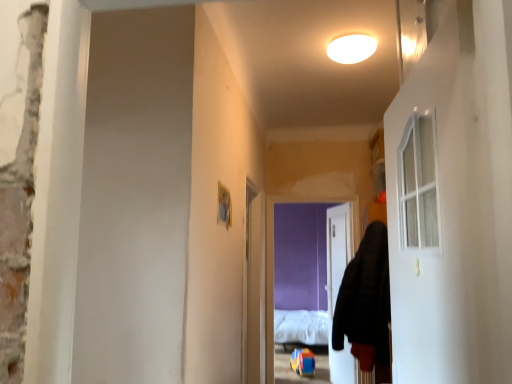
Question: Does black fuzzy hoodie at right come behind white matte ceiling light at upper center?

Choices:
 (A) no
 (B) yes

Answer: (B)

Question: Does black fuzzy hoodie at right have a greater width compared to white matte ceiling light at upper center?

Choices:
 (A) no
 (B) yes

Answer: (B)

Question: Does black fuzzy hoodie at right come in front of white matte ceiling light at upper center?

Choices:
 (A) yes
 (B) no

Answer: (B)

Question: Is black fuzzy hoodie at right looking in the opposite direction of white matte ceiling light at upper center?

Choices:
 (A) no
 (B) yes

Answer: (A)

Question: Does black fuzzy hoodie at right have a greater height compared to white matte ceiling light at upper center?

Choices:
 (A) yes
 (B) no

Answer: (A)

Question: Would you say clear plastic screen door at center is to the left or to the right of white fluffy bed at center in the picture?

Choices:
 (A) right
 (B) left

Answer: (B)

Question: From the image's perspective, relative to white fluffy bed at center, is clear plastic screen door at center above or below?

Choices:
 (A) above
 (B) below

Answer: (A)

Question: Based on their sizes in the image, would you say clear plastic screen door at center is bigger or smaller than white fluffy bed at center?

Choices:
 (A) small
 (B) big

Answer: (A)

Question: From a real-world perspective, is clear plastic screen door at center physically located above or below white fluffy bed at center?

Choices:
 (A) below
 (B) above

Answer: (B)

Question: Considering the relative positions of white fluffy bed at center and white matte ceiling light at upper center in the image provided, is white fluffy bed at center to the left or to the right of white matte ceiling light at upper center?

Choices:
 (A) right
 (B) left

Answer: (A)

Question: Considering the positions of white fluffy bed at center and white matte ceiling light at upper center in the image, is white fluffy bed at center wider or thinner than white matte ceiling light at upper center?

Choices:
 (A) wide
 (B) thin

Answer: (A)

Question: From a real-world perspective, is white fluffy bed at center positioned above or below white matte ceiling light at upper center?

Choices:
 (A) below
 (B) above

Answer: (A)

Question: From the image's perspective, relative to white matte ceiling light at upper center, is white fluffy bed at center above or below?

Choices:
 (A) below
 (B) above

Answer: (A)

Question: Does point (321, 332) appear closer or farther from the camera than point (253, 271)?

Choices:
 (A) closer
 (B) farther

Answer: (B)

Question: In terms of size, does white fluffy bed at center appear bigger or smaller than clear plastic screen door at center?

Choices:
 (A) big
 (B) small

Answer: (A)